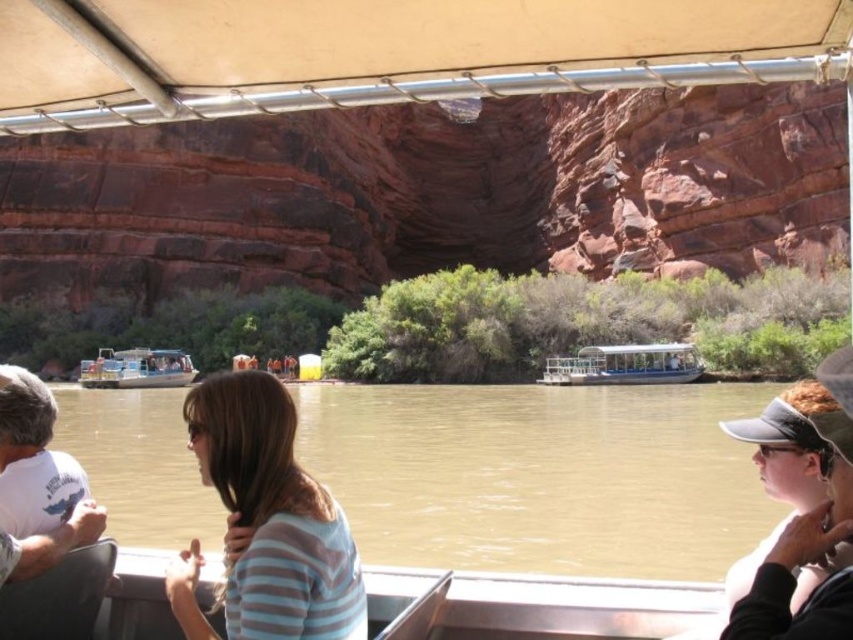
You are a photographer on the boat and want to take a photo of the striped fabric shirt at center and the matte black visor at lower right. Which object should you focus on first if you want to ensure both are in focus without adjusting the camera settings?

The striped fabric shirt at center is much taller than the matte black visor at lower right, so focusing on the striped fabric shirt at center first would help ensure both are in focus since it is farther away and the depth of field would cover the closer matte black visor at lower right.

You are a photographer on the cruise boat. You want to take a photo that includes both the matte black visor at lower right and the white plastic boat at left. Which object should you adjust your camera angle to focus on first to ensure both are in frame?

The matte black visor at lower right is taller than the white plastic boat at left, so you should focus on the matte black visor at lower right first to ensure both fit within the frame.